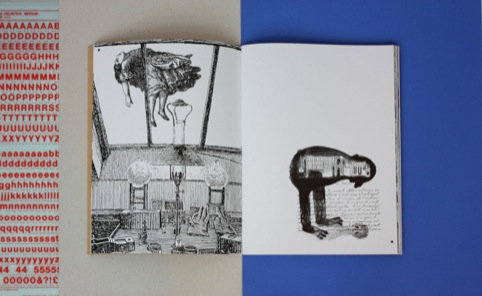
Identify the location of book. (239, 131).